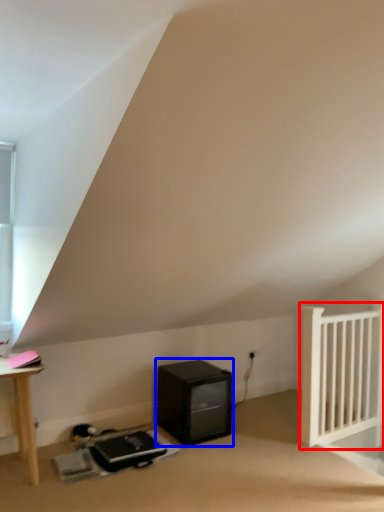
Question: Which object is further to the camera taking this photo, radiator (highlighted by a red box) or appliance (highlighted by a blue box)?

Choices:
 (A) radiator
 (B) appliance

Answer: (A)